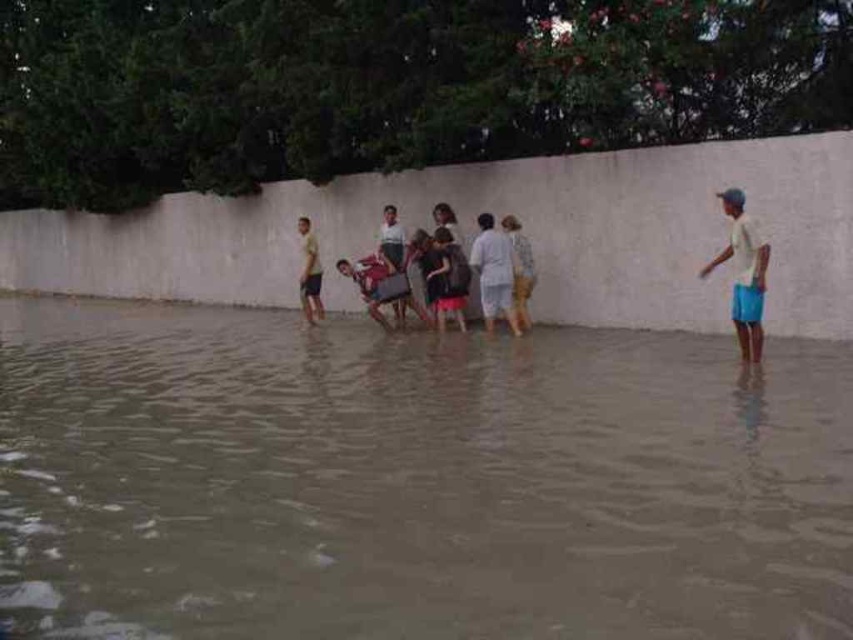
Question: Does plastic baby carriage at center appear on the right side of light brown fabric dress at center?

Choices:
 (A) yes
 (B) no

Answer: (B)

Question: Which point appears closest to the camera in this image?

Choices:
 (A) (509, 289)
 (B) (384, 225)

Answer: (A)

Question: Can you confirm if white cotton shirt at center is thinner than matte gray shirt at center?

Choices:
 (A) yes
 (B) no

Answer: (B)

Question: Which of the following is the farthest from the observer?

Choices:
 (A) (300, 278)
 (B) (339, 259)

Answer: (A)

Question: Estimate the real-world distances between objects in this image. Which object is closer to the light brown fabric dress at center?

Choices:
 (A) dark gray fabric dress at center
 (B) matte gray shirt at center
 (C) white cotton shirt at center

Answer: (C)

Question: Can you confirm if white cotton shirt at right is wider than matte gray shirt at center?

Choices:
 (A) yes
 (B) no

Answer: (A)